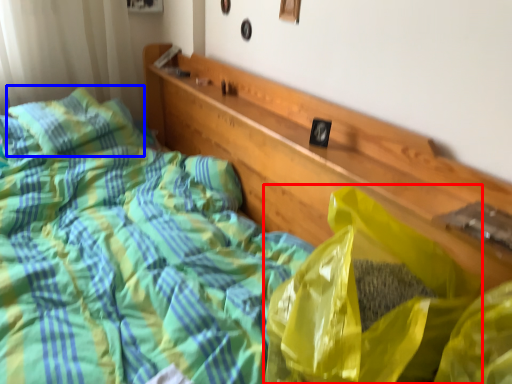
Question: Among these objects, which one is farthest to the camera, plastic bag (highlighted by a red box) or pillow (highlighted by a blue box)?

Choices:
 (A) plastic bag
 (B) pillow

Answer: (B)